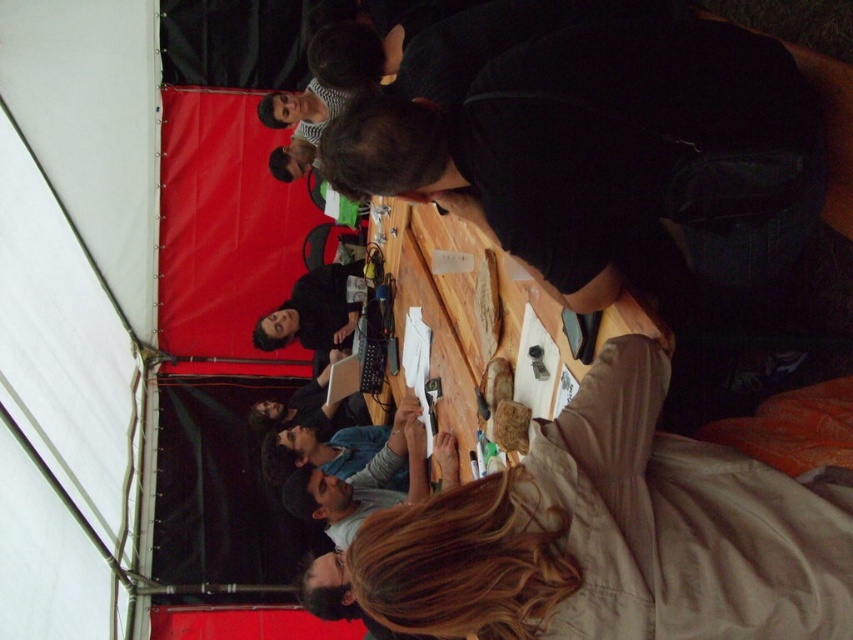
In the scene shown: Does light brown fabric jacket at center have a greater height compared to matte black laptop at center?

No.

Is point (732, 600) farther from camera compared to point (291, 410)?

That is False.

Between point (825, 541) and point (352, 422), which one is positioned in front?

Point (825, 541) is more forward.

At what (x,y) coordinates should I click in order to perform the action: click on light brown fabric jacket at center. Please return your answer as a coordinate pair (x, y). This screenshot has width=853, height=640. Looking at the image, I should click on (616, 532).

From the picture: Between light brown fabric jacket at center and wooden board at center, which one is positioned lower?

light brown fabric jacket at center is below.

From the picture: Can you confirm if light brown fabric jacket at center is positioned below wooden board at center?

Yes, light brown fabric jacket at center is below wooden board at center.

I want to click on light brown fabric jacket at center, so click(616, 532).

Describe the element at coordinates (463, 305) in the screenshot. I see `wooden board at center` at that location.

Between wooden board at center and matte black laptop at center, which one appears on the right side from the viewer's perspective?

Positioned to the right is wooden board at center.

Does point (515, 284) come behind point (256, 420)?

No, it is in front of (256, 420).

What are the coordinates of `wooden board at center` in the screenshot? It's located at (463, 305).